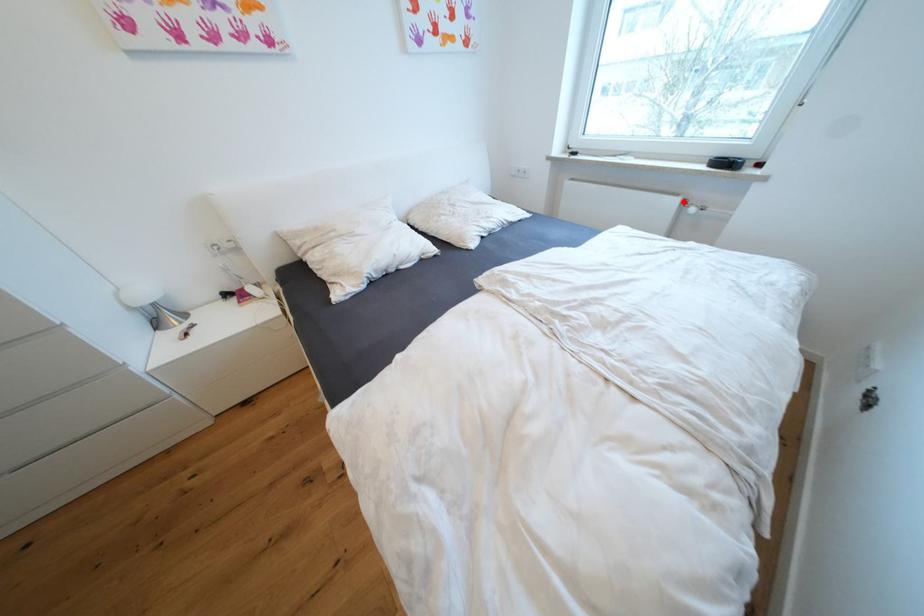
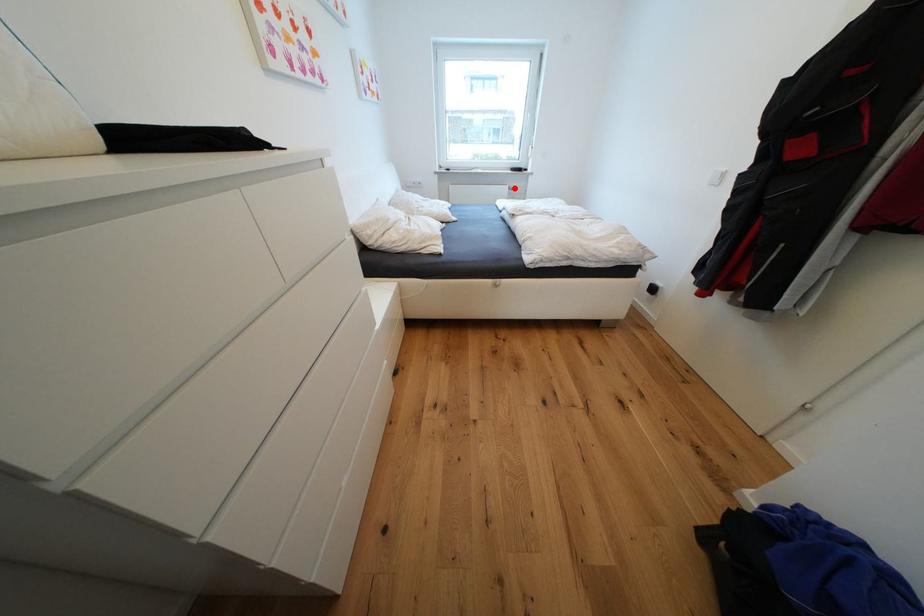
I am providing you with two images of the same scene from different viewpoints. A red point is marked on the first image and another point is marked on the second image. Are the points marked in image1 and image2 representing the same 3D position?

Yes